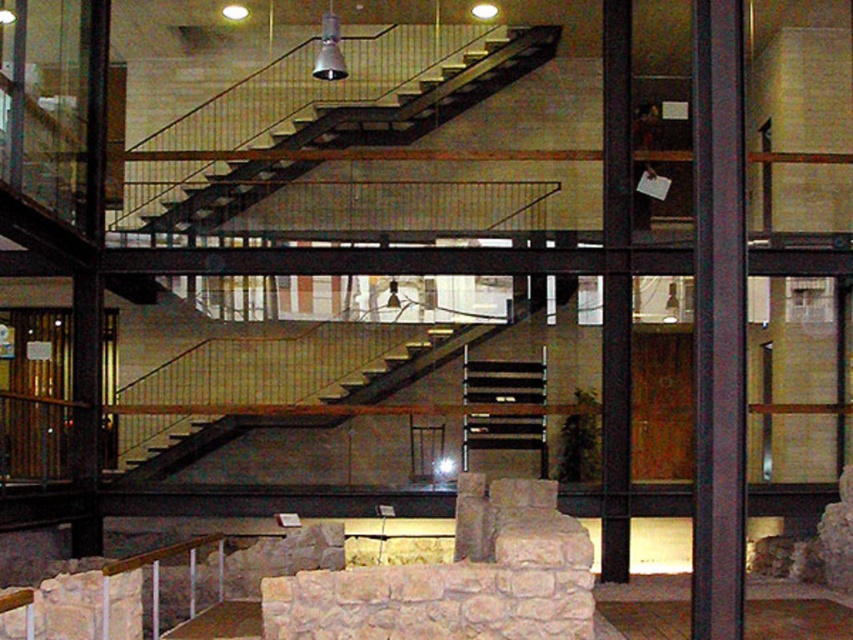
Question: Does metallic staircase at center appear over dark brown wood pillar at right?

Choices:
 (A) yes
 (B) no

Answer: (A)

Question: From the image, what is the correct spatial relationship of metallic staircase at center in relation to dark brown wood pillar at right?

Choices:
 (A) right
 (B) left

Answer: (B)

Question: Where is metallic staircase at center located in relation to dark brown wood pillar at right in the image?

Choices:
 (A) above
 (B) below

Answer: (A)

Question: Which point is closer to the camera?

Choices:
 (A) dark brown wood pillar at right
 (B) metallic staircase at center

Answer: (A)

Question: Which point is closer to the camera?

Choices:
 (A) metallic staircase at center
 (B) dark brown wood pillar at right

Answer: (B)